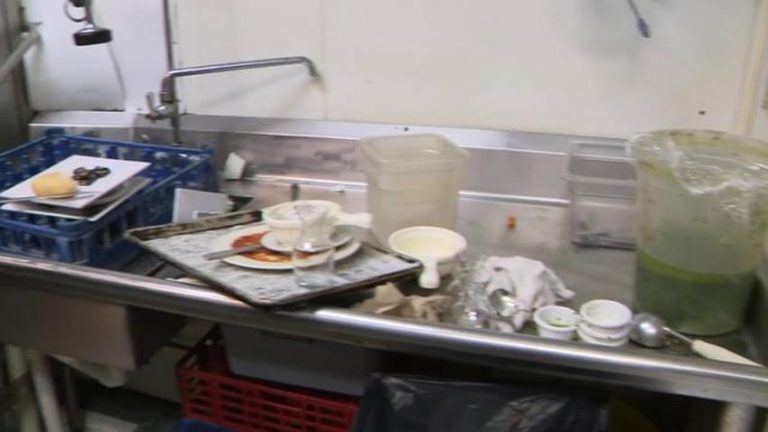
The width and height of the screenshot is (768, 432). In order to click on table leg in this screenshot , I will do `click(531, 271)`, `click(41, 387)`.